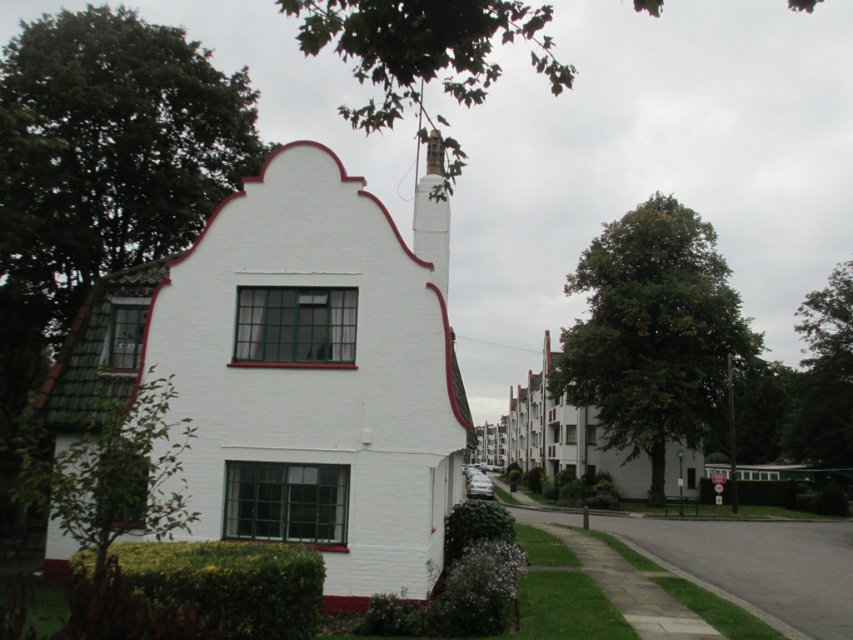
You are a drone operator tasked with photographing two chimneys on a building. The white painted brick chimney at center and the smooth gray chimney at center. From the ground, which chimney appears taller?

The white painted brick chimney at center appears taller because it has a greater height compared to the smooth gray chimney at center.

You are standing in front of the building and notice two chimneys. The first is a white painted brick chimney at center, and the second is a smooth gray chimney at center. Which chimney is located higher up on the roof?

The smooth gray chimney at center is located higher up on the roof because the white painted brick chimney at center is positioned under it.

You are standing in front of a building with two chimneys. You see the white painted brick chimney at center and the smooth gray chimney at center. Which one is located to the left?

The white painted brick chimney at center is located to the left of the smooth gray chimney at center.